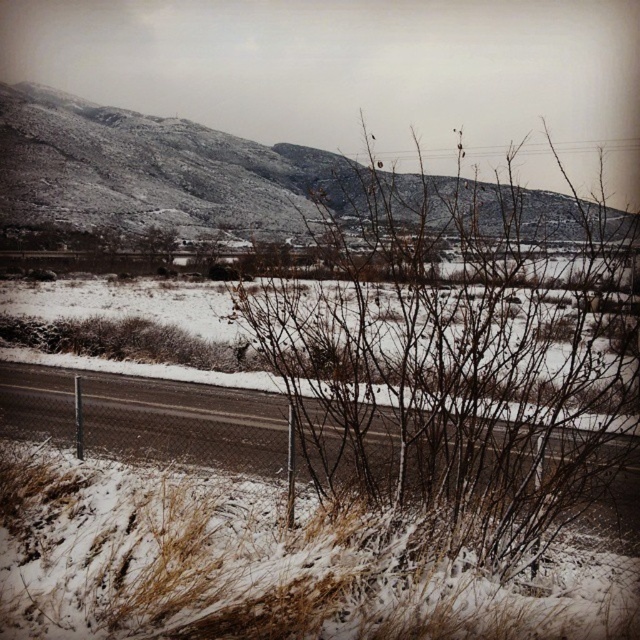
Question: Does brown/dry branches at center appear on the left side of gray asphalt highway at center?

Choices:
 (A) no
 (B) yes

Answer: (A)

Question: Is brown/dry branches at center bigger than gray asphalt highway at center?

Choices:
 (A) no
 (B) yes

Answer: (B)

Question: Which point appears farthest from the camera in this image?

Choices:
 (A) (262, 397)
 (B) (536, 216)

Answer: (B)

Question: Among these objects, which one is nearest to the camera?

Choices:
 (A) brown/dry branches at center
 (B) gray asphalt highway at center
 (C) snow-covered mountain at upper center

Answer: (A)

Question: Which object is the farthest from the gray asphalt highway at center?

Choices:
 (A) snow-covered mountain at upper center
 (B) brown/dry branches at center

Answer: (A)

Question: Observing the image, what is the correct spatial positioning of brown/dry branches at center in reference to snow-covered mountain at upper center?

Choices:
 (A) right
 (B) left

Answer: (A)